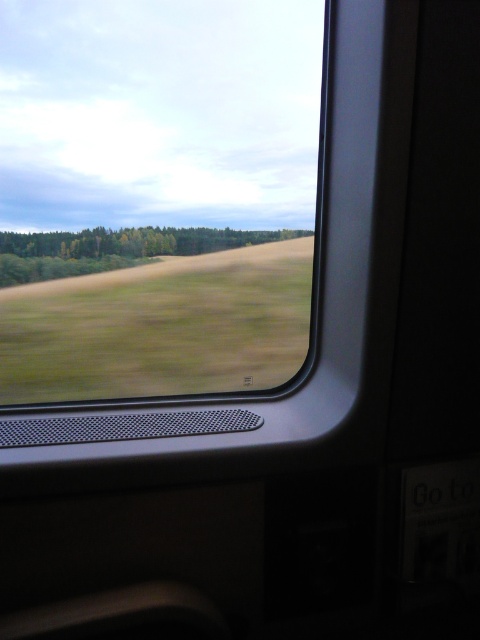
Based on the photo, who is positioned more to the right, transparent glass window at center or green matte forest at center?

Positioned to the right is green matte forest at center.

Can you confirm if transparent glass window at center is shorter than green matte forest at center?

No.

Describe the element at coordinates (156, 195) in the screenshot. I see `transparent glass window at center` at that location.

You are a GUI agent. You are given a task and a screenshot of the screen. Output one action in this format:
    pyautogui.click(x=<x>, y=<y>)
    Task: Click on the transparent glass window at center
    Image resolution: width=480 pixels, height=640 pixels.
    Given the screenshot: What is the action you would take?
    pyautogui.click(x=156, y=195)